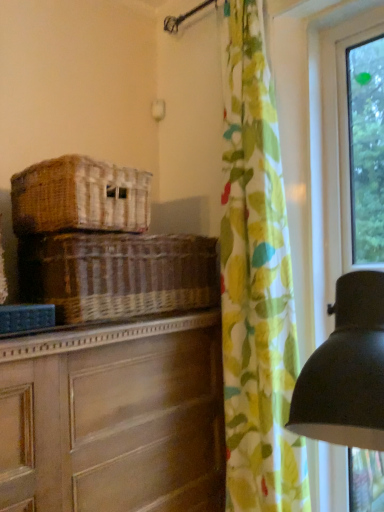
Question: Is woven brown basket at center, the second basket in the top-to-bottom sequence, at the right side of floral fabric curtain at right?

Choices:
 (A) yes
 (B) no

Answer: (B)

Question: Is woven brown basket at center, the second basket in the top-to-bottom sequence, shorter than floral fabric curtain at right?

Choices:
 (A) no
 (B) yes

Answer: (B)

Question: Is there a large distance between woven brown basket at center, which is the first basket in bottom-to-top order, and floral fabric curtain at right?

Choices:
 (A) yes
 (B) no

Answer: (B)

Question: Is woven brown basket at center, the second basket in the top-to-bottom sequence, oriented away from floral fabric curtain at right?

Choices:
 (A) yes
 (B) no

Answer: (B)

Question: Does woven brown basket at center, the second basket in the top-to-bottom sequence, have a lesser width compared to floral fabric curtain at right?

Choices:
 (A) yes
 (B) no

Answer: (B)

Question: Is woven brown basket at left, which is counted as the 2th basket, starting from the bottom, wider or thinner than wooden chest of drawers at left?

Choices:
 (A) wide
 (B) thin

Answer: (B)

Question: Looking at the image, does woven brown basket at left, which is counted as the 2th basket, starting from the bottom, seem bigger or smaller compared to wooden chest of drawers at left?

Choices:
 (A) small
 (B) big

Answer: (A)

Question: Which is correct: woven brown basket at left, arranged as the first basket when viewed from the top, is inside wooden chest of drawers at left, or outside of it?

Choices:
 (A) inside
 (B) outside

Answer: (B)

Question: Is point (56, 178) positioned closer to the camera than point (119, 349)?

Choices:
 (A) farther
 (B) closer

Answer: (B)

Question: From a real-world perspective, relative to woven brown basket at left, arranged as the first basket when viewed from the top, is wooden chest of drawers at left vertically above or below?

Choices:
 (A) below
 (B) above

Answer: (A)

Question: Is wooden chest of drawers at left spatially inside woven brown basket at left, which is counted as the 2th basket, starting from the bottom, or outside of it?

Choices:
 (A) inside
 (B) outside

Answer: (B)

Question: Based on their sizes in the image, would you say wooden chest of drawers at left is bigger or smaller than woven brown basket at left, which is counted as the 2th basket, starting from the bottom?

Choices:
 (A) big
 (B) small

Answer: (A)

Question: Is wooden chest of drawers at left to the left or to the right of woven brown basket at left, arranged as the first basket when viewed from the top, in the image?

Choices:
 (A) left
 (B) right

Answer: (B)

Question: In terms of size, does woven brown basket at center, which is the first basket in bottom-to-top order, appear bigger or smaller than woven brown basket at left, arranged as the first basket when viewed from the top?

Choices:
 (A) big
 (B) small

Answer: (A)

Question: From a real-world perspective, is woven brown basket at center, the second basket in the top-to-bottom sequence, above or below woven brown basket at left, arranged as the first basket when viewed from the top?

Choices:
 (A) above
 (B) below

Answer: (B)